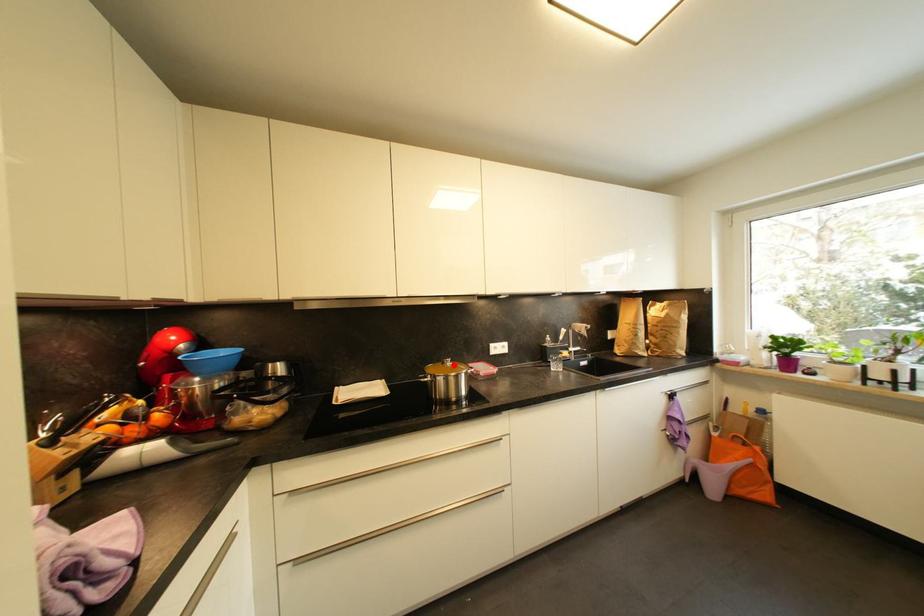
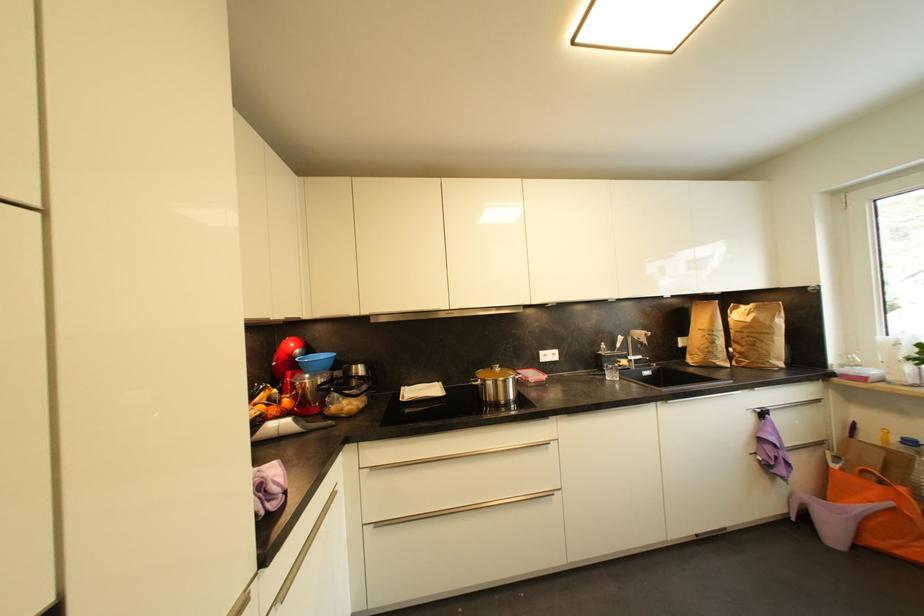
Locate, in the second image, the point that corresponds to the highlighted location in the first image.

(503, 371)